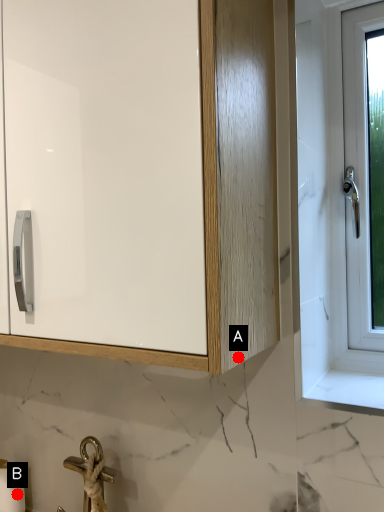
Question: Two points are circled on the image, labeled by A and B beside each circle. Among these points, which one is farthest from the camera?

Choices:
 (A) A is further
 (B) B is further

Answer: (B)